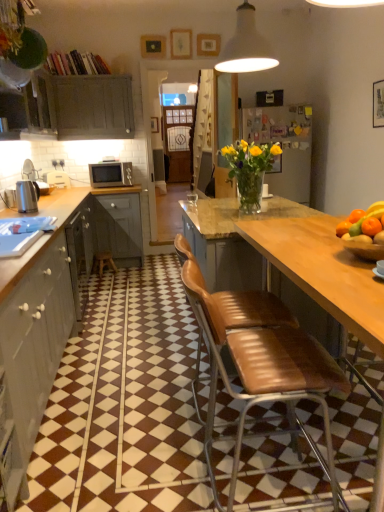
Find the location of a particular element. Image resolution: width=384 pixels, height=512 pixels. brown leather chair at center, which appears as the second chair when viewed from the back is located at coordinates (264, 375).

The height and width of the screenshot is (512, 384). What do you see at coordinates (35, 342) in the screenshot? I see `matte gray cabinets at left, acting as the 3th cabinetry starting from the top` at bounding box center [35, 342].

Image resolution: width=384 pixels, height=512 pixels. Find the location of `white matte pendant lamp at upper center`. white matte pendant lamp at upper center is located at coordinates (246, 46).

From the image's perspective, is brown leather chair at center, which appears as the second chair when viewed from the front, on top of wooden picture frame at upper center?

No, from the image's perspective, brown leather chair at center, which appears as the second chair when viewed from the front, is not above wooden picture frame at upper center.

Is point (211, 295) positioned before point (204, 35)?

Yes, it is.

Could you tell me if brown leather chair at center, acting as the 1th chair starting from the back, is turned towards wooden picture frame at upper center?

No, brown leather chair at center, acting as the 1th chair starting from the back, is not facing towards wooden picture frame at upper center.

This screenshot has width=384, height=512. In order to click on microwave oven behind the matte gray cabinets at left, which is counted as the 2th cabinetry, starting from the back in this screenshot , I will do `click(110, 174)`.

Is matte gray cabinets at left, which ranks as the 2th cabinetry in front-to-back order, positioned with its back to silver metallic microwave at left?

No, matte gray cabinets at left, which ranks as the 2th cabinetry in front-to-back order,'s orientation is not away from silver metallic microwave at left.

From the image's perspective, is matte gray cabinets at left, which is counted as the 2th cabinetry, starting from the back, on top of silver metallic microwave at left?

No, from the image's perspective, matte gray cabinets at left, which is counted as the 2th cabinetry, starting from the back, is not over silver metallic microwave at left.

Is matte gray cabinets at left, the 2th cabinetry in the top-to-bottom sequence, taller than silver metallic microwave at left?

Indeed, matte gray cabinets at left, the 2th cabinetry in the top-to-bottom sequence, has a greater height compared to silver metallic microwave at left.

Measure the distance between silver metallic microwave at left and matte gray cabinet at left, the first cabinetry positioned from the top.

21.87 inches.

Which is in front, point (119, 184) or point (42, 103)?

Positioned in front is point (42, 103).

Is silver metallic microwave at left directly adjacent to matte gray cabinet at left, placed as the 3th cabinetry when sorted from front to back?

No, silver metallic microwave at left is not in contact with matte gray cabinet at left, placed as the 3th cabinetry when sorted from front to back.

Is silver metallic microwave at left looking in the opposite direction of matte gray cabinet at left, placed as the 3th cabinetry when sorted from front to back?

No, silver metallic microwave at left is not facing away from matte gray cabinet at left, placed as the 3th cabinetry when sorted from front to back.

From the image's perspective, would you say brown leather bar stool at center is positioned over silver metallic microwave at left?

No, from the image's perspective, brown leather bar stool at center is not above silver metallic microwave at left.

Between brown leather bar stool at center and silver metallic microwave at left, which one appears on the right side from the viewer's perspective?

silver metallic microwave at left is more to the right.

Consider the image. Is brown leather bar stool at center not close to silver metallic microwave at left?

brown leather bar stool at center is near silver metallic microwave at left, not far away.

Which object is closer to the camera, brown leather bar stool at center or silver metallic microwave at left?

brown leather bar stool at center is in front.

Looking at their sizes, would you say matte gray cabinet at left, positioned as the 3th cabinetry in bottom-to-top order, is wider or thinner than silver metallic microwave at left?

Considering their sizes, matte gray cabinet at left, positioned as the 3th cabinetry in bottom-to-top order, looks slimmer than silver metallic microwave at left.

Which point is more distant from viewer, [93,77] or [92,166]?

The point [92,166] is behind.

Is matte gray cabinet at left, the first cabinetry positioned from the top, positioned beyond the bounds of silver metallic microwave at left?

Yes, matte gray cabinet at left, the first cabinetry positioned from the top, is outside of silver metallic microwave at left.

Who is taller, matte gray cabinet at left, which ranks as the first cabinetry in back-to-front order, or silver metallic microwave at left?

With more height is matte gray cabinet at left, which ranks as the first cabinetry in back-to-front order.

From the image's perspective, is white matte pendant lamp at upper center located beneath silver metallic microwave at left?

Incorrect, from the image's perspective, white matte pendant lamp at upper center is higher than silver metallic microwave at left.

How many degrees apart are the facing directions of white matte pendant lamp at upper center and silver metallic microwave at left?

white matte pendant lamp at upper center and silver metallic microwave at left are facing 180 degrees away from each other.

Based on the photo, which of these two, white matte pendant lamp at upper center or silver metallic microwave at left, is bigger?

white matte pendant lamp at upper center is bigger.

Find the location of `light fixture on the right of silver metallic microwave at left`. light fixture on the right of silver metallic microwave at left is located at coordinates (246, 46).

How many degrees apart are the facing directions of white matte pendant lamp at upper center and matte gray cabinets at left, which is counted as the 1th cabinetry, starting from the bottom?

There is a 91.4-degree angle between the facing directions of white matte pendant lamp at upper center and matte gray cabinets at left, which is counted as the 1th cabinetry, starting from the bottom.

Which is closer to the camera, (231, 39) or (63, 255)?

Point (231, 39) appears to be farther away from the viewer than point (63, 255).

From a real-world perspective, is white matte pendant lamp at upper center positioned above or below matte gray cabinets at left, which is counted as the 1th cabinetry, starting from the bottom?

white matte pendant lamp at upper center is above matte gray cabinets at left, which is counted as the 1th cabinetry, starting from the bottom.

Between white matte pendant lamp at upper center and matte gray cabinets at left, the third cabinetry in the back-to-front sequence, which one has larger size?

With larger size is matte gray cabinets at left, the third cabinetry in the back-to-front sequence.

You are a GUI agent. You are given a task and a screenshot of the screen. Output one action in this format:
    pyautogui.click(x=<x>, y=<y>)
    Task: Click on the chair on the left of wooden picture frame at upper center
    
    Given the screenshot: What is the action you would take?
    pyautogui.click(x=252, y=310)

At what (x,y) coordinates should I click in order to perform the action: click on microwave oven that appears above the matte gray cabinets at left, positioned as the 2th cabinetry in bottom-to-top order (from a real-world perspective). Please return your answer as a coordinate pair (x, y). The width and height of the screenshot is (384, 512). Looking at the image, I should click on (110, 174).

Considering their positions, is silver metallic microwave at left positioned further to wooden picture frame at upper center than polished stainless steel kettle at left?

polished stainless steel kettle at left.

From the image, which object appears to be farther from brown leather chair at center, positioned as the 1th chair in front-to-back order, polished stainless steel kettle at left or white matte pendant lamp at upper center?

polished stainless steel kettle at left is further to brown leather chair at center, positioned as the 1th chair in front-to-back order.

Based on the photo, considering their positions, is silver metallic microwave at left positioned further to white matte pendant lamp at upper center than brown leather chair at center, which appears as the second chair when viewed from the back?

silver metallic microwave at left is positioned further to the anchor white matte pendant lamp at upper center.

From the image, which object appears to be farther from matte gray cabinets at left, which ranks as the 2th cabinetry in front-to-back order, brown leather chair at center, which appears as the second chair when viewed from the front, or matte gray cabinets at left, which is counted as the 1th cabinetry, starting from the bottom?

brown leather chair at center, which appears as the second chair when viewed from the front, is positioned further to the anchor matte gray cabinets at left, which ranks as the 2th cabinetry in front-to-back order.

From the image, which object appears to be nearer to brown leather bar stool at center, brown leather chair at center, which appears as the second chair when viewed from the front, or matte gray cabinets at left, which is counted as the 1th cabinetry, starting from the bottom?

Among the two, matte gray cabinets at left, which is counted as the 1th cabinetry, starting from the bottom, is located nearer to brown leather bar stool at center.

Looking at the image, which one is located closer to polished stainless steel kettle at left, matte gray cabinets at left, which is counted as the 2th cabinetry, starting from the back, or brown leather chair at center, which appears as the second chair when viewed from the front?

Among the two, matte gray cabinets at left, which is counted as the 2th cabinetry, starting from the back, is located nearer to polished stainless steel kettle at left.

From the image, which object appears to be farther from matte gray cabinets at left, positioned as the 2th cabinetry in bottom-to-top order, white matte pendant lamp at upper center or translucent glass vase at center?

white matte pendant lamp at upper center.

Based on their spatial positions, is wooden picture frame at upper center or brown leather bar stool at center further from brown leather chair at center, acting as the 1th chair starting from the back?

The object further to brown leather chair at center, acting as the 1th chair starting from the back, is wooden picture frame at upper center.

You are a GUI agent. You are given a task and a screenshot of the screen. Output one action in this format:
    pyautogui.click(x=<x>, y=<y>)
    Task: Click on the light fixture between brown leather chair at center, acting as the 1th chair starting from the back, and silver metallic microwave at left in the front-back direction
    This screenshot has height=512, width=384.
    Given the screenshot: What is the action you would take?
    pyautogui.click(x=246, y=46)

Find the location of a particular element. The image size is (384, 512). cabinetry between wooden picture frame at upper center and matte gray cabinets at left, positioned as the 2th cabinetry in bottom-to-top order, from top to bottom is located at coordinates (74, 106).

At what (x,y) coordinates should I click in order to perform the action: click on light fixture positioned between matte gray cabinets at left, which is the 1th cabinetry from front to back, and brown leather bar stool at center from near to far. Please return your answer as a coordinate pair (x, y). Looking at the image, I should click on (246, 46).

Image resolution: width=384 pixels, height=512 pixels. Find the location of `floral arrangement positioned between brown leather chair at center, acting as the 1th chair starting from the back, and wooden picture frame at upper center from near to far`. floral arrangement positioned between brown leather chair at center, acting as the 1th chair starting from the back, and wooden picture frame at upper center from near to far is located at coordinates (250, 170).